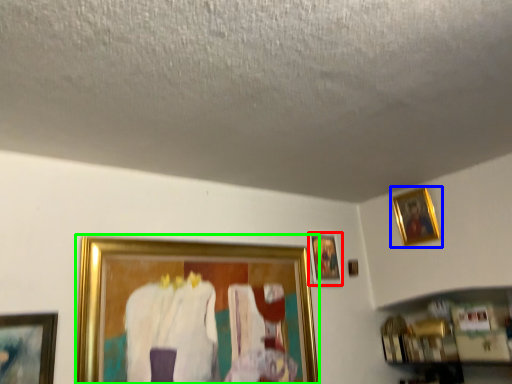
Question: Which is farther away from picture frame (highlighted by a red box)? picture frame (highlighted by a blue box) or picture frame (highlighted by a green box)?

Choices:
 (A) picture frame
 (B) picture frame

Answer: (A)